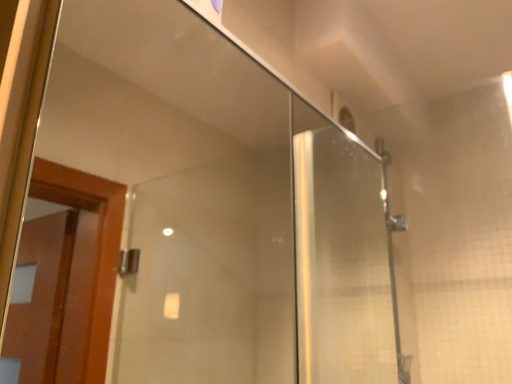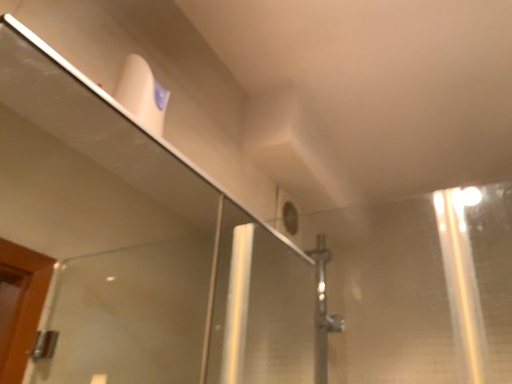
Question: How did the camera likely rotate when shooting the video?

Choices:
 (A) rotated downward
 (B) rotated upward

Answer: (B)